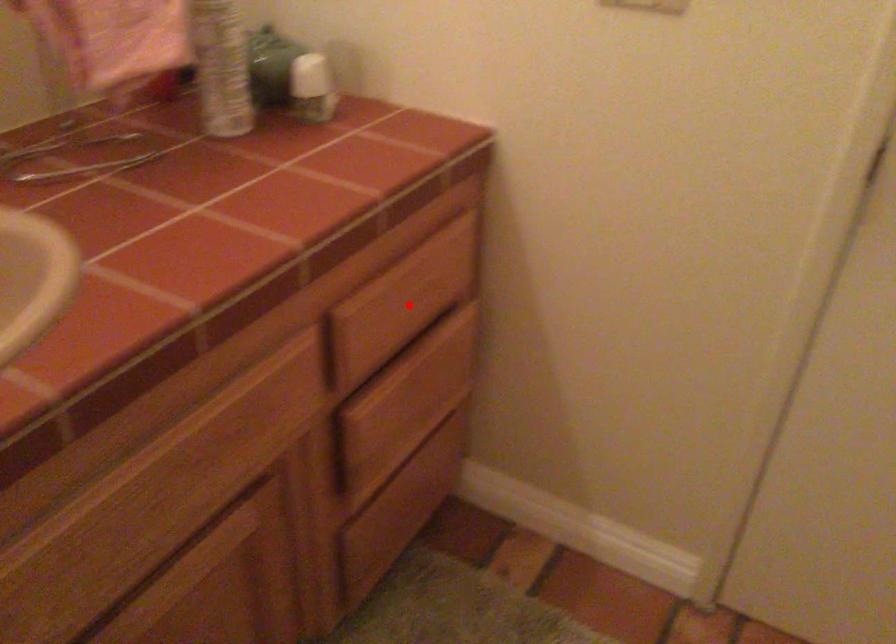
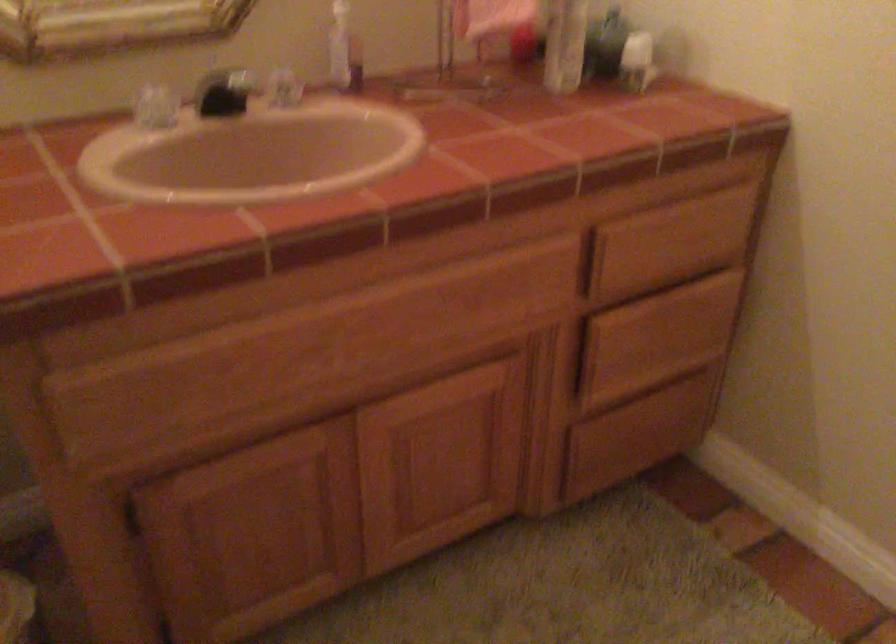
In the second image, find the point that corresponds to the highlighted location in the first image.

(668, 243)